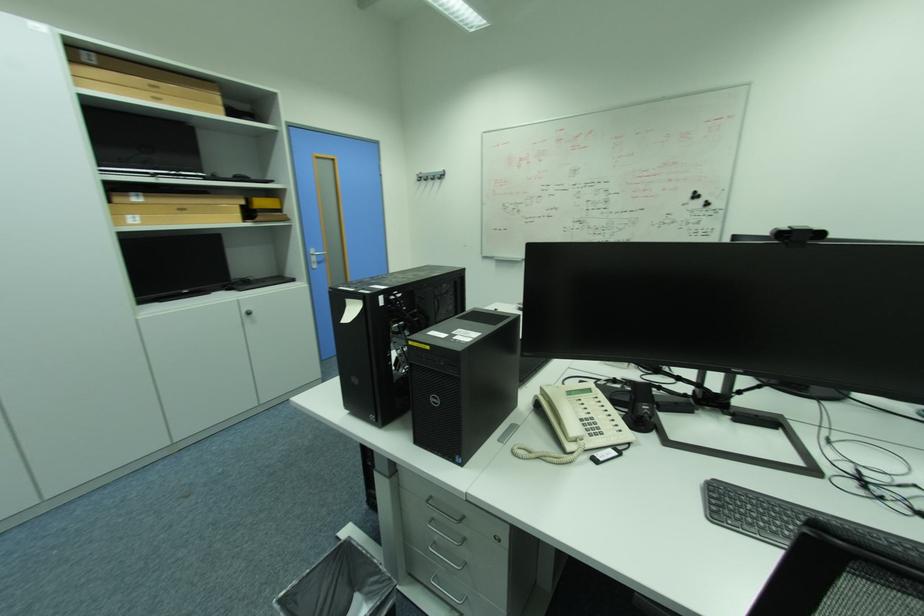
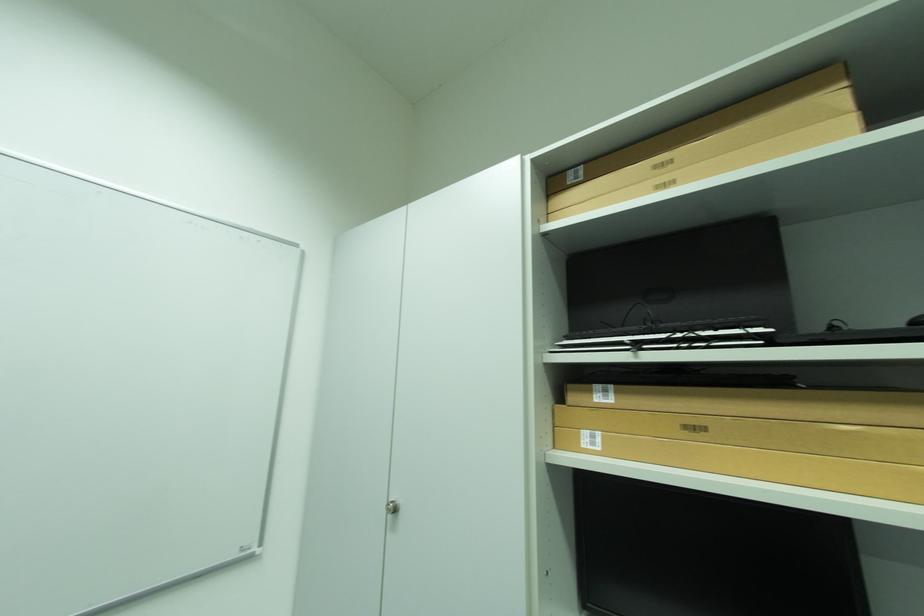
Locate, in the second image, the point that corresponds to [143,197] in the first image.

(614, 392)